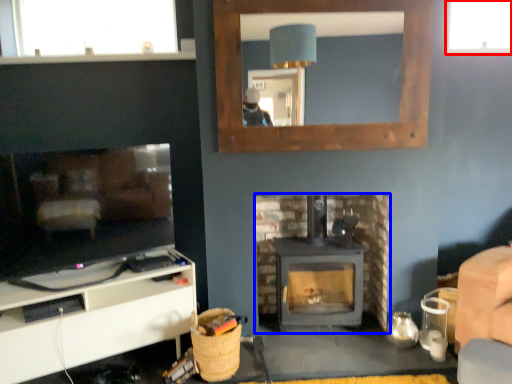
Question: Which object is closer to the camera taking this photo, window (highlighted by a red box) or fireplace (highlighted by a blue box)?

Choices:
 (A) window
 (B) fireplace

Answer: (B)